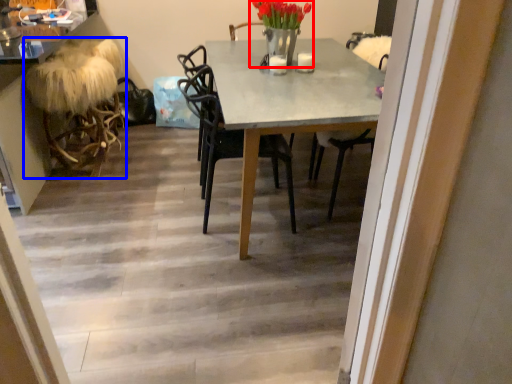
Question: Which object is further to the camera taking this photo, floral arrangement (highlighted by a red box) or rocking chair (highlighted by a blue box)?

Choices:
 (A) floral arrangement
 (B) rocking chair

Answer: (B)